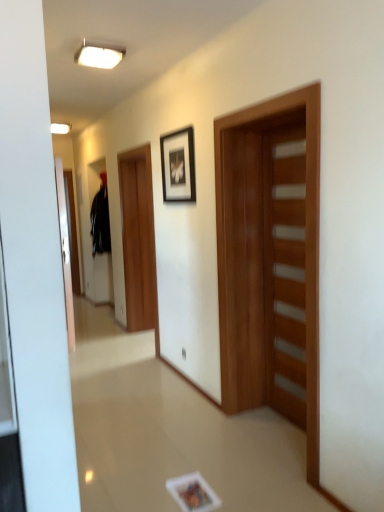
Question: Does wooden door at right, which ranks as the 2th door in left-to-right order, have a lesser height compared to wooden door at center, which is the 2th door from right to left?

Choices:
 (A) yes
 (B) no

Answer: (A)

Question: Can you confirm if wooden door at right, which ranks as the 2th door in left-to-right order, is smaller than wooden door at center, which is the 2th door from right to left?

Choices:
 (A) yes
 (B) no

Answer: (A)

Question: From the image's perspective, is wooden door at right, which ranks as the 2th door in left-to-right order, on top of wooden door at center, which is the 2th door from right to left?

Choices:
 (A) no
 (B) yes

Answer: (A)

Question: Would you say wooden door at center, marked as the 1th door in a left-to-right arrangement, is part of wooden door at right, marked as the first door in a right-to-left arrangement,'s contents?

Choices:
 (A) no
 (B) yes

Answer: (A)

Question: Is wooden door at right, marked as the first door in a right-to-left arrangement, to the right of wooden door at center, marked as the 1th door in a left-to-right arrangement, from the viewer's perspective?

Choices:
 (A) yes
 (B) no

Answer: (A)

Question: Is wooden door at center, marked as the 1th door in a left-to-right arrangement, at the back of wooden door at right, marked as the first door in a right-to-left arrangement?

Choices:
 (A) yes
 (B) no

Answer: (A)

Question: From the image's perspective, is wooden door at center, which is the 2th door from right to left, over wooden door at right, marked as the first door in a right-to-left arrangement?

Choices:
 (A) yes
 (B) no

Answer: (A)

Question: Does wooden door at center, which is the 2th door from right to left, appear on the right side of wooden door at right, which ranks as the 2th door in left-to-right order?

Choices:
 (A) no
 (B) yes

Answer: (A)

Question: Considering the relative sizes of wooden door at center, which is the 2th door from right to left, and wooden door at right, which ranks as the 2th door in left-to-right order, in the image provided, is wooden door at center, which is the 2th door from right to left, shorter than wooden door at right, which ranks as the 2th door in left-to-right order,?

Choices:
 (A) yes
 (B) no

Answer: (B)

Question: Does wooden door at center, which is the 2th door from right to left, have a smaller size compared to wooden door at right, marked as the first door in a right-to-left arrangement?

Choices:
 (A) yes
 (B) no

Answer: (B)

Question: Does wooden door at center, which is the 2th door from right to left, have a greater height compared to wooden door at right, marked as the first door in a right-to-left arrangement?

Choices:
 (A) no
 (B) yes

Answer: (B)

Question: Is wooden door at center, which is the 2th door from right to left, bigger than wooden door at right, which ranks as the 2th door in left-to-right order?

Choices:
 (A) no
 (B) yes

Answer: (B)

Question: From a real-world perspective, does black matte picture frame at upper center sit lower than black matte sweatshirt at left?

Choices:
 (A) yes
 (B) no

Answer: (B)